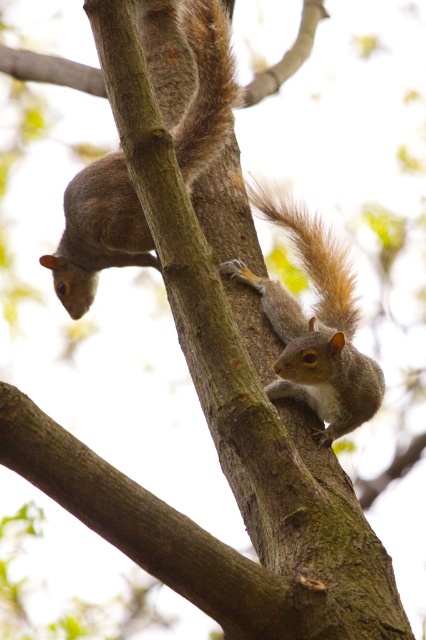
Question: In this image, where is gray fur squirrel at center located relative to gray furry squirrel at center?

Choices:
 (A) below
 (B) above

Answer: (B)

Question: Which of these objects is positioned closest to the gray furry squirrel at center?

Choices:
 (A) gray fur squirrel at center
 (B) fuzzy brown tail at right

Answer: (B)

Question: Which point is farther to the camera?

Choices:
 (A) fuzzy brown tail at right
 (B) gray fur squirrel at center
 (C) gray furry squirrel at center

Answer: (A)

Question: Can you confirm if gray furry squirrel at center is positioned above fuzzy brown tail at right?

Choices:
 (A) no
 (B) yes

Answer: (A)

Question: Considering the real-world distances, which object is farthest from the gray fur squirrel at center?

Choices:
 (A) gray furry squirrel at center
 (B) fuzzy brown tail at right

Answer: (A)

Question: Does gray fur squirrel at center have a greater width compared to gray furry squirrel at center?

Choices:
 (A) yes
 (B) no

Answer: (A)